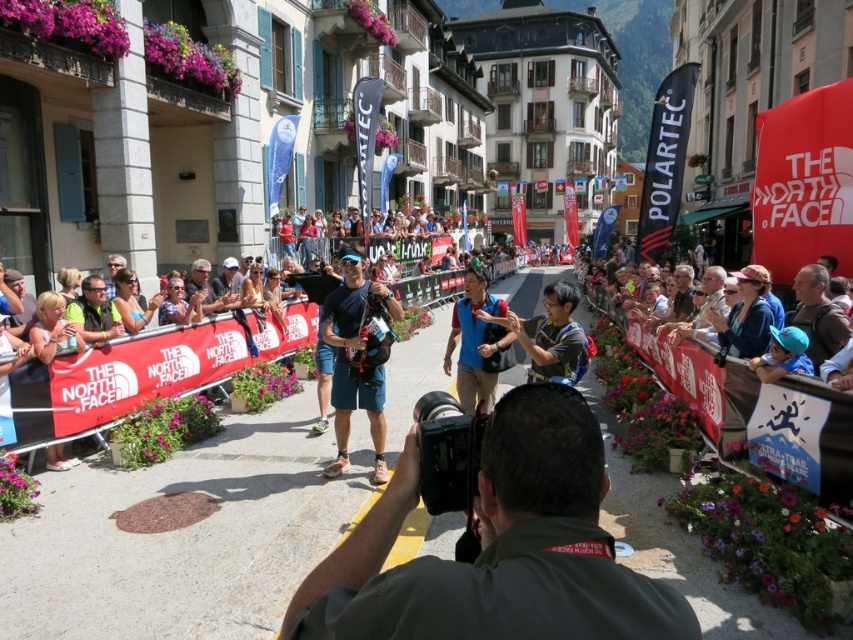
Question: Which object appears farthest from the camera in this image?

Choices:
 (A) matte blue shirt at center
 (B) blue fabric vest at center
 (C) brown leather backpack at right
 (D) matte black sunglasses at center

Answer: (B)

Question: Among these objects, which one is farthest from the camera?

Choices:
 (A) blue fabric vest at center
 (B) brown leather backpack at right
 (C) matte black sunglasses at center

Answer: (A)

Question: Does dark gray uniform at center lie in front of brown leather backpack at right?

Choices:
 (A) yes
 (B) no

Answer: (A)

Question: Which object is closer to the camera taking this photo?

Choices:
 (A) brown leather backpack at right
 (B) matte blue shirt at center

Answer: (A)

Question: Is brown leather backpack at right wider than matte black sunglasses at center?

Choices:
 (A) yes
 (B) no

Answer: (B)

Question: Is dark gray uniform at center to the left of matte blue shorts at center from the viewer's perspective?

Choices:
 (A) no
 (B) yes

Answer: (A)